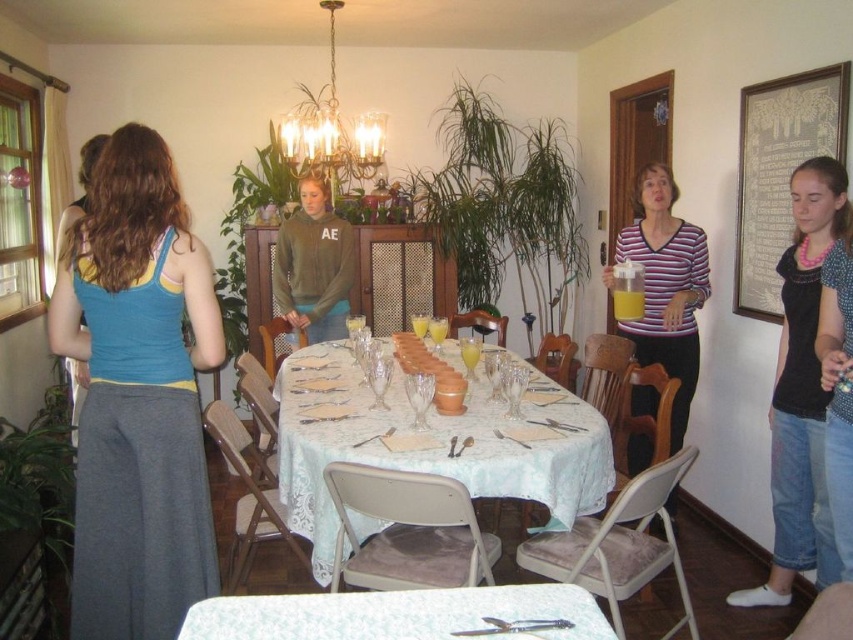
From the picture: You are a guest at the dining table and need to choose between wearing the blue fabric tank top at left or the gold metallic chandelier at upper center. Which one is smaller in size?

The blue fabric tank top at left is smaller in size compared to the gold metallic chandelier at upper center.

You are a guest at the dining table and want to admire the pink beaded necklace at upper right and the gold metallic chandelier at upper center. Which of these two items is narrower in width?

The pink beaded necklace at upper right is narrower in width compared to the gold metallic chandelier at upper center.